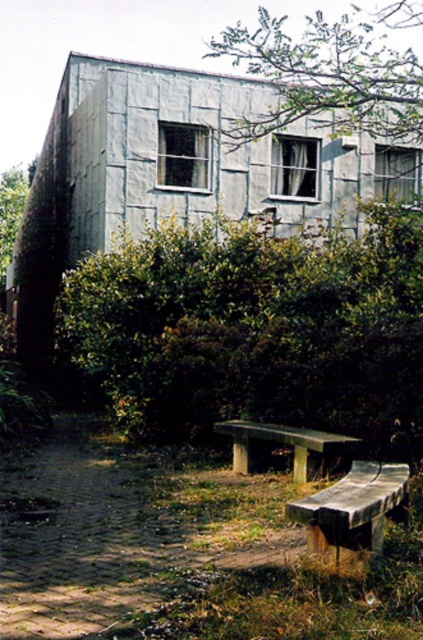
You are planning to install a new bench in the garden area between the green leafy hedge at center and the green leafy tree at left. Based on their widths, which one would allow more space on its side for people to walk around?

The green leafy hedge at center has a lesser width compared to the green leafy tree at left, so there will be more space on the side of the green leafy hedge at center for people to walk around.

You are standing at the entrance of the building and want to walk to the green leafy hedge at center. According to the coordinates provided, in which direction should you move relative to the building?

The green leafy hedge at center is located at point (255, 326), which means it is positioned to the right and slightly forward of the entrance. You should move towards the right side of the building and slightly forward to reach it.